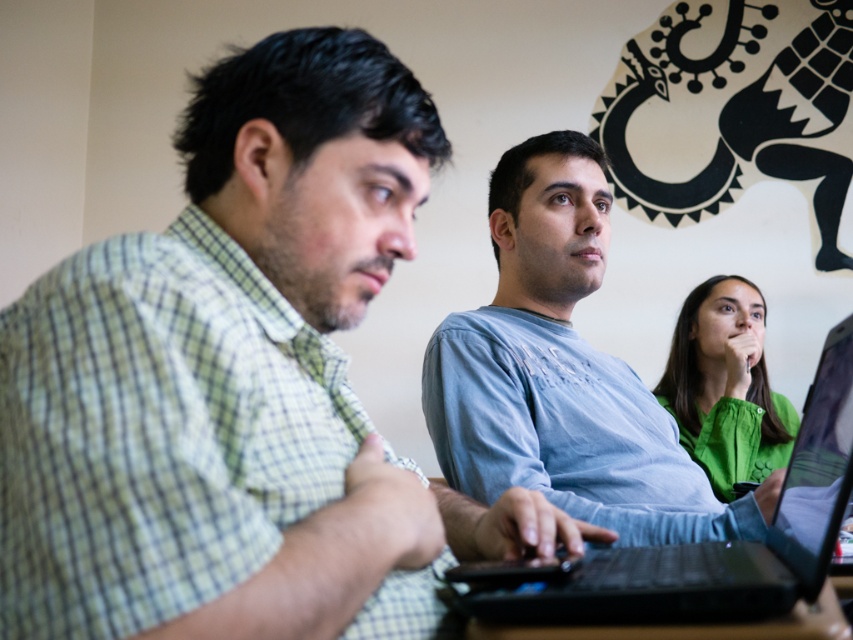
Who is positioned more to the right, black matte laptop at center or black plastic table at lower center?

Positioned to the right is black matte laptop at center.

In the scene shown: Is black matte laptop at center wider than black plastic table at lower center?

Yes, black matte laptop at center is wider than black plastic table at lower center.

Locate an element on the screen. The image size is (853, 640). black matte laptop at center is located at coordinates (717, 541).

Is light blue cotton shirt at center positioned at the back of black matte laptop at center?

Yes, light blue cotton shirt at center is further from the viewer.

Can you confirm if light blue cotton shirt at center is smaller than black matte laptop at center?

Incorrect, light blue cotton shirt at center is not smaller in size than black matte laptop at center.

I want to click on light blue cotton shirt at center, so (x=561, y=372).

Who is more forward, (x=759, y=528) or (x=695, y=637)?

Point (x=695, y=637) is more forward.

Between point (552, 170) and point (579, 634), which one is positioned behind?

The point (552, 170) is more distant.

At what (x,y) coordinates should I click in order to perform the action: click on light blue cotton shirt at center. Please return your answer as a coordinate pair (x, y). This screenshot has height=640, width=853. Looking at the image, I should click on (561, 372).